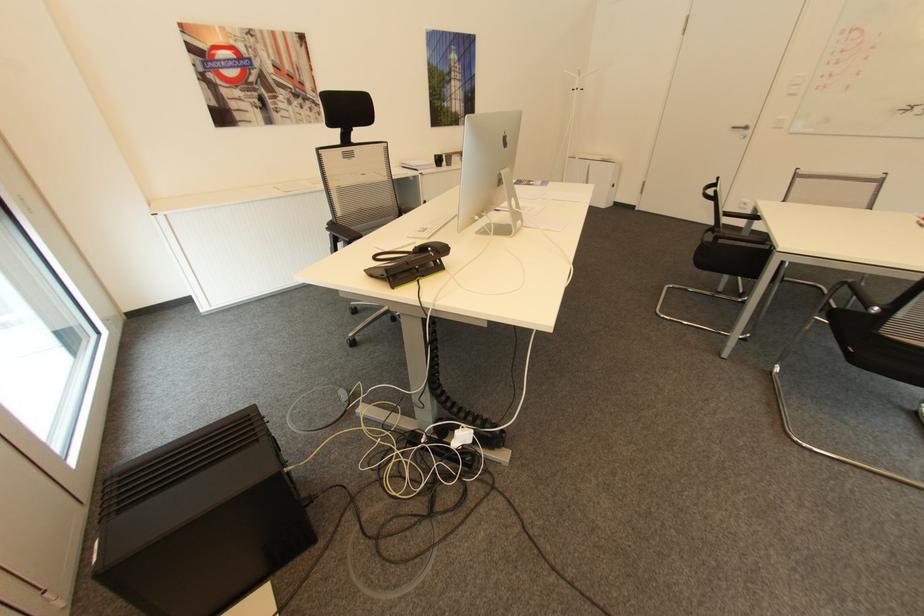
Where is `striped chair sitting surface`? Image resolution: width=924 pixels, height=616 pixels. striped chair sitting surface is located at coordinates (744, 254).